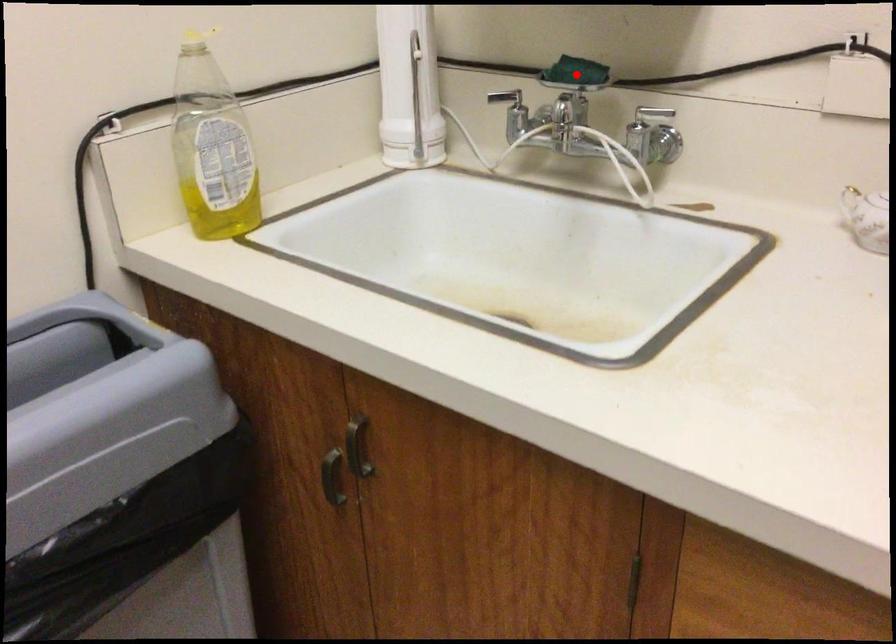
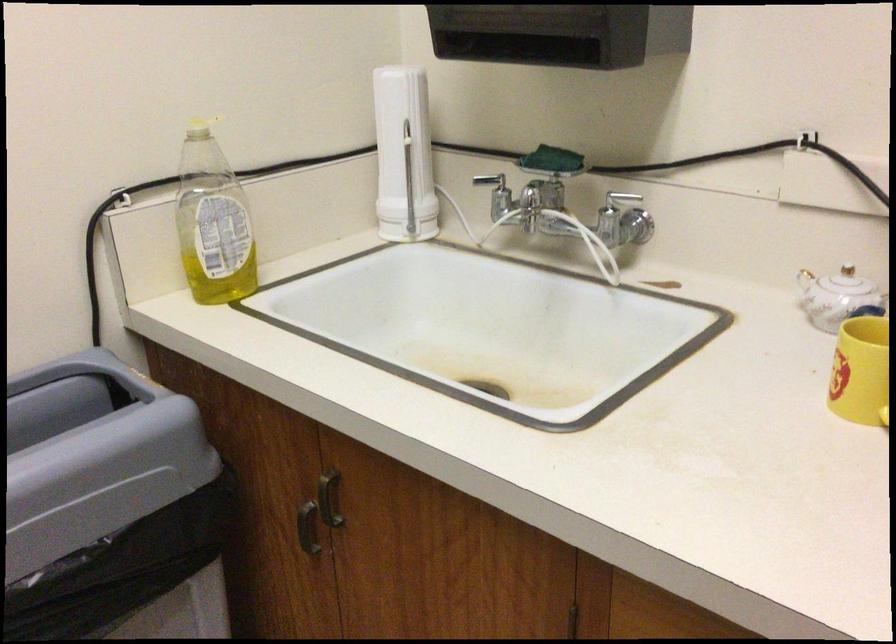
Find the pixel in the second image that matches the highlighted location in the first image.

(552, 160)